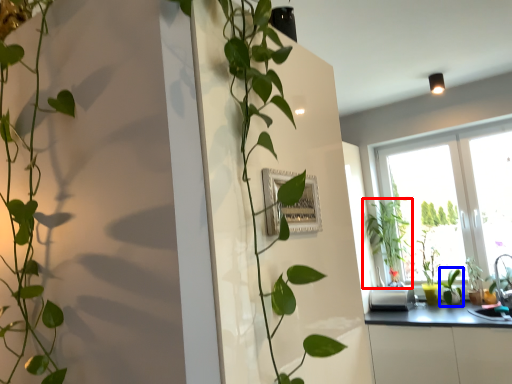
Question: Which object appears closest to the camera in this image, houseplant (highlighted by a red box) or plant (highlighted by a blue box)?

Choices:
 (A) houseplant
 (B) plant

Answer: (B)